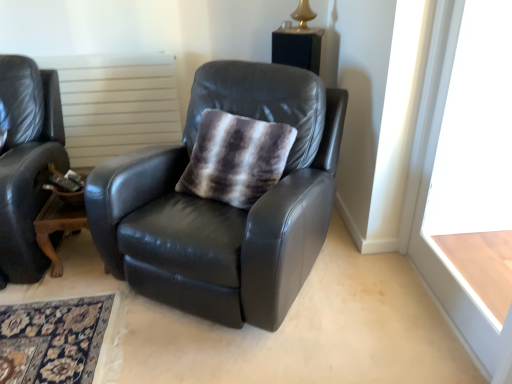
Question: Is white wood window frame at right smaller than white textured radiator at upper center?

Choices:
 (A) yes
 (B) no

Answer: (B)

Question: Does white wood window frame at right have a lesser width compared to white textured radiator at upper center?

Choices:
 (A) no
 (B) yes

Answer: (B)

Question: Would you say white wood window frame at right is a long distance from white textured radiator at upper center?

Choices:
 (A) yes
 (B) no

Answer: (A)

Question: Is white wood window frame at right at the left side of white textured radiator at upper center?

Choices:
 (A) no
 (B) yes

Answer: (A)

Question: Does white wood window frame at right contain white textured radiator at upper center?

Choices:
 (A) yes
 (B) no

Answer: (B)

Question: Considering the positions of matte black leather chair at center and fuzzy brown and white throw pillow at center in the image, is matte black leather chair at center bigger or smaller than fuzzy brown and white throw pillow at center?

Choices:
 (A) big
 (B) small

Answer: (A)

Question: Is point (253, 276) closer or farther from the camera than point (274, 150)?

Choices:
 (A) closer
 (B) farther

Answer: (A)

Question: From the image's perspective, is matte black leather chair at center above or below fuzzy brown and white throw pillow at center?

Choices:
 (A) below
 (B) above

Answer: (A)

Question: Is matte black leather chair at center spatially inside fuzzy brown and white throw pillow at center, or outside of it?

Choices:
 (A) inside
 (B) outside

Answer: (B)

Question: Looking at their shapes, would you say matte black leather chair at center is wider or thinner than brown wooden table at lower left?

Choices:
 (A) wide
 (B) thin

Answer: (A)

Question: Considering their positions, is matte black leather chair at center located in front of or behind brown wooden table at lower left?

Choices:
 (A) front
 (B) behind

Answer: (A)

Question: Considering the positions of point (249, 297) and point (74, 216), is point (249, 297) closer or farther from the camera than point (74, 216)?

Choices:
 (A) farther
 (B) closer

Answer: (B)

Question: Is matte black leather chair at center inside the boundaries of brown wooden table at lower left, or outside?

Choices:
 (A) inside
 (B) outside

Answer: (B)

Question: From a real-world perspective, is matte black leather chair at center positioned above or below white wood window frame at right?

Choices:
 (A) above
 (B) below

Answer: (B)

Question: In the image, is matte black leather chair at center positioned in front of or behind white wood window frame at right?

Choices:
 (A) front
 (B) behind

Answer: (B)